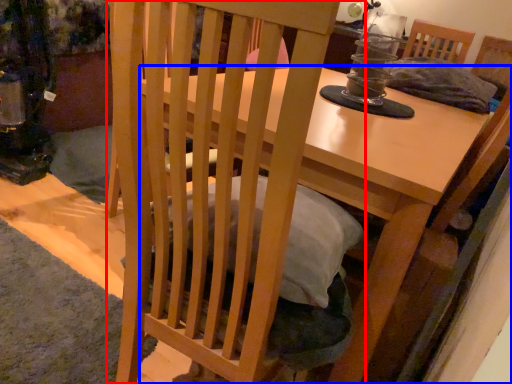
Question: Which object appears closest to the camera in this image, chair (highlighted by a red box) or table (highlighted by a blue box)?

Choices:
 (A) chair
 (B) table

Answer: (A)